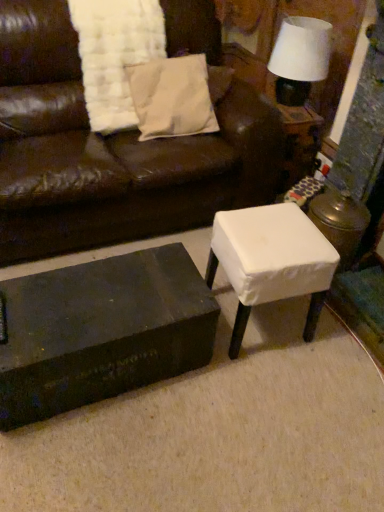
Where is `white fabric lampshade at upper right`? white fabric lampshade at upper right is located at coordinates (300, 58).

The height and width of the screenshot is (512, 384). Describe the element at coordinates (300, 58) in the screenshot. I see `white fabric lampshade at upper right` at that location.

In order to face black matte/wooden coffee table at lower left, should I rotate leftwards or rightwards?

You should rotate left by 12.607 degrees.

What do you see at coordinates (299, 143) in the screenshot? I see `white fabric-covered stool at right` at bounding box center [299, 143].

Image resolution: width=384 pixels, height=512 pixels. In order to click on white cotton pillow at upper center in this screenshot , I will do `click(172, 97)`.

Describe the element at coordinates (115, 55) in the screenshot. I see `white textured blanket at upper left` at that location.

I want to click on matte brown leather couch at center, so click(111, 152).

Does white fabric lampshade at upper right have a larger size compared to white cotton pillow at upper center?

Actually, white fabric lampshade at upper right might be smaller than white cotton pillow at upper center.

Between white fabric lampshade at upper right and white cotton pillow at upper center, which one appears on the right side from the viewer's perspective?

white fabric lampshade at upper right is more to the right.

Would you consider white fabric lampshade at upper right to be distant from white cotton pillow at upper center?

Actually, white fabric lampshade at upper right and white cotton pillow at upper center are a little close together.

Based on the photo, considering the positions of objects white fabric-covered stool at right and white fabric lampshade at upper right in the image provided, who is in front, white fabric-covered stool at right or white fabric lampshade at upper right?

white fabric lampshade at upper right is closer to the camera.

Are white fabric-covered stool at right and white fabric lampshade at upper right making contact?

No, white fabric-covered stool at right is not making contact with white fabric lampshade at upper right.

Is white fabric-covered stool at right spatially inside white fabric lampshade at upper right, or outside of it?

white fabric-covered stool at right lies outside white fabric lampshade at upper right.

Looking at this image, can you tell me how much white fabric stool at center and white fabric-covered stool at right differ in facing direction?

There is a 95.3-degree angle between the facing directions of white fabric stool at center and white fabric-covered stool at right.

From the image's perspective, which is below, white fabric stool at center or white fabric-covered stool at right?

white fabric stool at center appears lower in the image.

Is white fabric stool at center to the left or to the right of white fabric-covered stool at right in the image?

white fabric stool at center is to the left of white fabric-covered stool at right.

Are white cotton pillow at upper center and white textured blanket at upper left beside each other?

They are not placed beside each other.

From the image's perspective, relative to white textured blanket at upper left, is white cotton pillow at upper center above or below?

Clearly, from the image's perspective, white cotton pillow at upper center is below white textured blanket at upper left.

How different are the orientations of white cotton pillow at upper center and white textured blanket at upper left in degrees?

There is a 0.000218-degree angle between the facing directions of white cotton pillow at upper center and white textured blanket at upper left.

Could white textured blanket at upper left be considered to be inside white cotton pillow at upper center?

No, white cotton pillow at upper center does not contain white textured blanket at upper left.

Consider the image. Is matte brown leather couch at center oriented away from black matte/wooden coffee table at lower left?

No.

Where is `coffee table in front of the matte brown leather couch at center`? Image resolution: width=384 pixels, height=512 pixels. coffee table in front of the matte brown leather couch at center is located at coordinates (101, 331).

Is matte brown leather couch at center far from black matte/wooden coffee table at lower left?

Actually, matte brown leather couch at center and black matte/wooden coffee table at lower left are a little close together.

Which object is positioned more to the left, matte brown leather couch at center or black matte/wooden coffee table at lower left?

black matte/wooden coffee table at lower left is more to the left.

Which of these two, black matte/wooden coffee table at lower left or white fabric-covered stool at right, is smaller?

white fabric-covered stool at right is smaller.

Is black matte/wooden coffee table at lower left wider than white fabric-covered stool at right?

Incorrect, the width of black matte/wooden coffee table at lower left does not surpass that of white fabric-covered stool at right.

From their relative heights in the image, would you say black matte/wooden coffee table at lower left is taller or shorter than white fabric-covered stool at right?

In the image, black matte/wooden coffee table at lower left appears to be shorter than white fabric-covered stool at right.

Is white fabric-covered stool at right inside black matte/wooden coffee table at lower left?

That's incorrect, white fabric-covered stool at right is not inside black matte/wooden coffee table at lower left.

From a real-world perspective, is black matte/wooden coffee table at lower left positioned over matte brown leather couch at center based on gravity?

No, from a real-world perspective, black matte/wooden coffee table at lower left is not on top of matte brown leather couch at center.

Is black matte/wooden coffee table at lower left turned away from matte brown leather couch at center?

Correct, black matte/wooden coffee table at lower left is looking away from matte brown leather couch at center.

Who is taller, black matte/wooden coffee table at lower left or matte brown leather couch at center?

matte brown leather couch at center is taller.

Is black matte/wooden coffee table at lower left inside or outside of matte brown leather couch at center?

black matte/wooden coffee table at lower left is outside matte brown leather couch at center.

You are a GUI agent. You are given a task and a screenshot of the screen. Output one action in this format:
    pyautogui.click(x=<x>, y=<y>)
    Task: Click on the table lamp positioned vertically above the white cotton pillow at upper center (from a real-world perspective)
    
    Given the screenshot: What is the action you would take?
    pyautogui.click(x=300, y=58)

Identify the location of side table that is under the white fabric lampshade at upper right (from a real-world perspective). (299, 143).

Looking at the image, which one is located further to white fabric stool at center, white fabric-covered stool at right or white textured blanket at upper left?

The object further to white fabric stool at center is white textured blanket at upper left.

Considering their positions, is white fabric stool at center positioned closer to white textured blanket at upper left than white fabric-covered stool at right?

white fabric-covered stool at right.

In the scene shown: From the image, which object appears to be farther from white fabric lampshade at upper right, white cotton pillow at upper center or matte brown leather couch at center?

matte brown leather couch at center is positioned further to the anchor white fabric lampshade at upper right.

From the image, which object appears to be nearer to black matte/wooden coffee table at lower left, white fabric-covered stool at right or white fabric stool at center?

The object closer to black matte/wooden coffee table at lower left is white fabric stool at center.

Which object lies further to the anchor point black matte/wooden coffee table at lower left, white fabric lampshade at upper right or white fabric stool at center?

white fabric lampshade at upper right is further to black matte/wooden coffee table at lower left.

From the picture: Which object lies nearer to the anchor point white fabric lampshade at upper right, matte brown leather couch at center or white textured blanket at upper left?

white textured blanket at upper left lies closer to white fabric lampshade at upper right than the other object.

Which object lies further to the anchor point white fabric lampshade at upper right, black matte/wooden coffee table at lower left or matte brown leather couch at center?

black matte/wooden coffee table at lower left lies further to white fabric lampshade at upper right than the other object.

Which object lies further to the anchor point white fabric lampshade at upper right, black matte/wooden coffee table at lower left or white cotton pillow at upper center?

Based on the image, black matte/wooden coffee table at lower left appears to be further to white fabric lampshade at upper right.

At what (x,y) coordinates should I click in order to perform the action: click on studio couch between white textured blanket at upper left and white fabric stool at center in the vertical direction. Please return your answer as a coordinate pair (x, y). Image resolution: width=384 pixels, height=512 pixels. Looking at the image, I should click on (111, 152).

The height and width of the screenshot is (512, 384). In order to click on blanket that lies between white fabric lampshade at upper right and black matte/wooden coffee table at lower left from top to bottom in this screenshot , I will do `click(115, 55)`.

Identify the location of side table that lies between white cotton pillow at upper center and white fabric stool at center from top to bottom. (299, 143).

What are the coordinates of `side table situated between white cotton pillow at upper center and white fabric lampshade at upper right from left to right` in the screenshot? It's located at (299, 143).